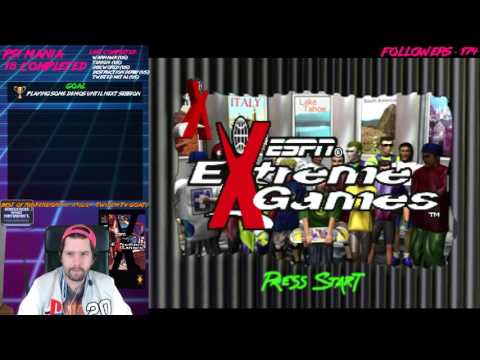
At what (x,y) coordinates should I click in order to perform the action: click on trophy. Please return your answer as a coordinate pair (x, y). The image size is (480, 360). Looking at the image, I should click on (20, 96).